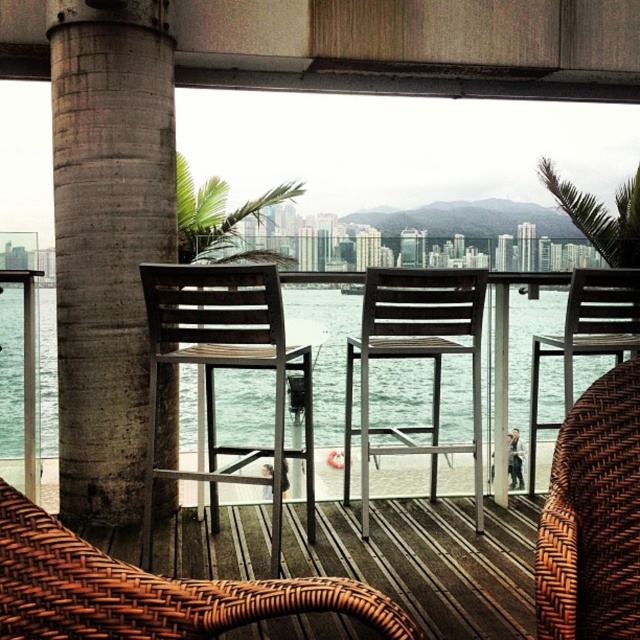
Is point (92, 586) positioned before point (637, 321)?

That is True.

Who is shorter, brown woven armchair at lower left or woven brown armchair at right?

Standing shorter between the two is brown woven armchair at lower left.

Is point (284, 595) positioned behind point (580, 330)?

No.

You are a GUI agent. You are given a task and a screenshot of the screen. Output one action in this format:
    pyautogui.click(x=<x>, y=<y>)
    Task: Click on the brown woven armchair at lower left
    
    Given the screenshot: What is the action you would take?
    pyautogui.click(x=147, y=589)

Describe the element at coordinates (324, 349) in the screenshot. I see `clear water at table center` at that location.

Describe the element at coordinates (324, 349) in the screenshot. I see `clear water at table center` at that location.

At what (x,y) coordinates should I click in order to perform the action: click on clear water at table center. Please return your answer as a coordinate pair (x, y). Image resolution: width=640 pixels, height=640 pixels. Looking at the image, I should click on (324, 349).

Does clear water at table center lie in front of brown woven chair at center?

That is False.

Based on the photo, is clear water at table center wider than brown woven chair at center?

Yes.

Who is more forward, (262, 388) or (205, 476)?

Point (205, 476) is in front.

I want to click on clear water at table center, so click(324, 349).